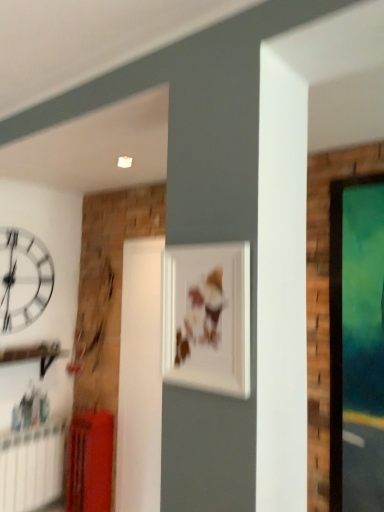
Question: Is white glossy clock at upper left positioned beyond the bounds of matte white picture frame at center?

Choices:
 (A) yes
 (B) no

Answer: (A)

Question: Does white glossy clock at upper left have a larger size compared to matte white picture frame at center?

Choices:
 (A) no
 (B) yes

Answer: (B)

Question: Is white glossy clock at upper left behind matte white picture frame at center?

Choices:
 (A) yes
 (B) no

Answer: (A)

Question: Is white glossy clock at upper left shorter than matte white picture frame at center?

Choices:
 (A) yes
 (B) no

Answer: (B)

Question: Is white glossy clock at upper left positioned with its back to matte white picture frame at center?

Choices:
 (A) yes
 (B) no

Answer: (B)

Question: Is matte white picture frame at center located within white glossy clock at upper left?

Choices:
 (A) no
 (B) yes

Answer: (A)

Question: Can you confirm if matte white picture frame at center is taller than matte red radiator at lower left?

Choices:
 (A) no
 (B) yes

Answer: (A)

Question: Is matte white picture frame at center aimed at matte red radiator at lower left?

Choices:
 (A) no
 (B) yes

Answer: (A)

Question: From the image's perspective, would you say matte white picture frame at center is positioned over matte red radiator at lower left?

Choices:
 (A) no
 (B) yes

Answer: (B)

Question: Can you see matte white picture frame at center touching matte red radiator at lower left?

Choices:
 (A) no
 (B) yes

Answer: (A)

Question: From a real-world perspective, does matte white picture frame at center sit lower than matte red radiator at lower left?

Choices:
 (A) yes
 (B) no

Answer: (B)

Question: Does matte white picture frame at center have a larger size compared to matte red radiator at lower left?

Choices:
 (A) yes
 (B) no

Answer: (B)

Question: Is white plastic radiator at lower left shorter than matte white picture frame at center?

Choices:
 (A) no
 (B) yes

Answer: (A)